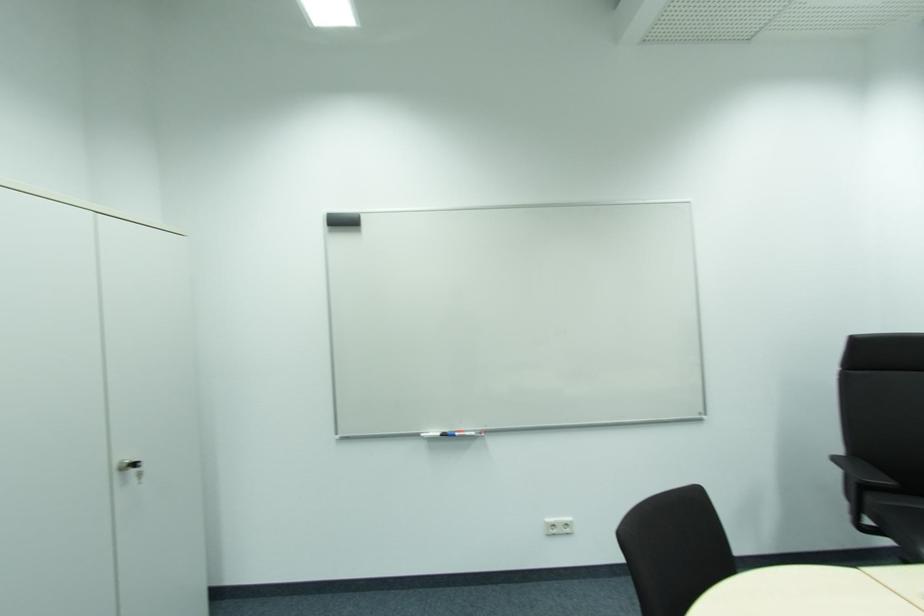
What do you see at coordinates (558, 525) in the screenshot? I see `the white wall socket` at bounding box center [558, 525].